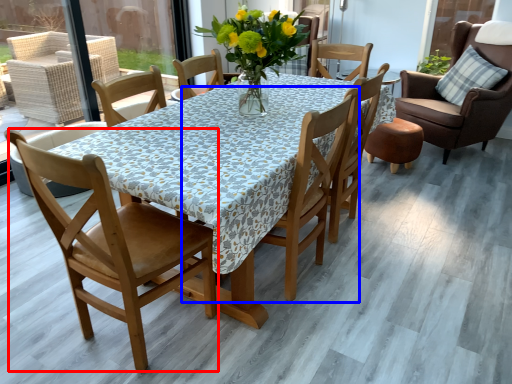
Question: Which of the following is the farthest to the observer, chair (highlighted by a red box) or chair (highlighted by a blue box)?

Choices:
 (A) chair
 (B) chair

Answer: (B)